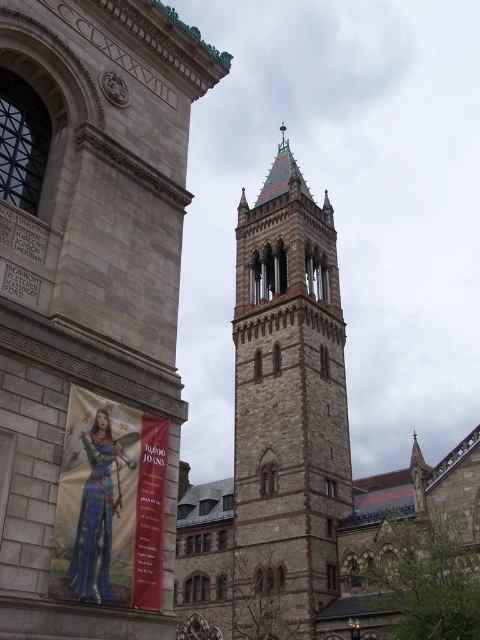
Find the location of a particular element. brown stone tower at upper center is located at coordinates click(x=92, y=310).

Measure the distance from brown stone tower at upper center to matte gold banner at lower left.

A distance of 10.59 feet exists between brown stone tower at upper center and matte gold banner at lower left.

Who is more forward, (82,211) or (91,404)?

Positioned in front is point (91,404).

You are a GUI agent. You are given a task and a screenshot of the screen. Output one action in this format:
    pyautogui.click(x=<x>, y=<y>)
    Task: Click on the brown stone tower at upper center
    
    Given the screenshot: What is the action you would take?
    pyautogui.click(x=92, y=310)

Does brown stone tower at center come behind matte gold banner at lower left?

That is True.

Is brown stone tower at center positioned before matte gold banner at lower left?

No, brown stone tower at center is further to the viewer.

The image size is (480, 640). Identify the location of brown stone tower at center. (287, 408).

Does brown stone tower at upper center have a greater width compared to brown stone tower at center?

In fact, brown stone tower at upper center might be narrower than brown stone tower at center.

This screenshot has width=480, height=640. What are the coordinates of `brown stone tower at upper center` in the screenshot? It's located at (92, 310).

Is point (22, 577) less distant than point (308, 500)?

That is True.

Where is `brown stone tower at upper center`? brown stone tower at upper center is located at coordinates (92, 310).